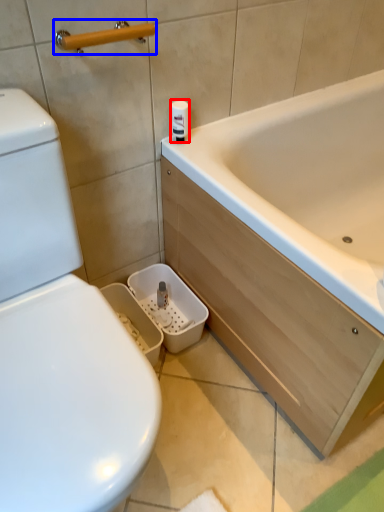
Question: Among these objects, which one is farthest to the camera, toilet paper (highlighted by a red box) or towel bar (highlighted by a blue box)?

Choices:
 (A) toilet paper
 (B) towel bar

Answer: (A)